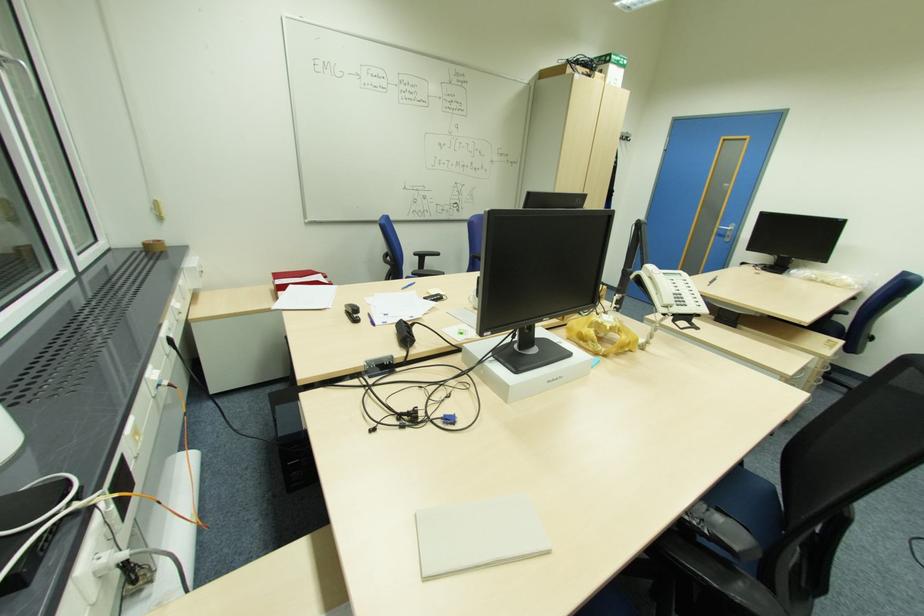
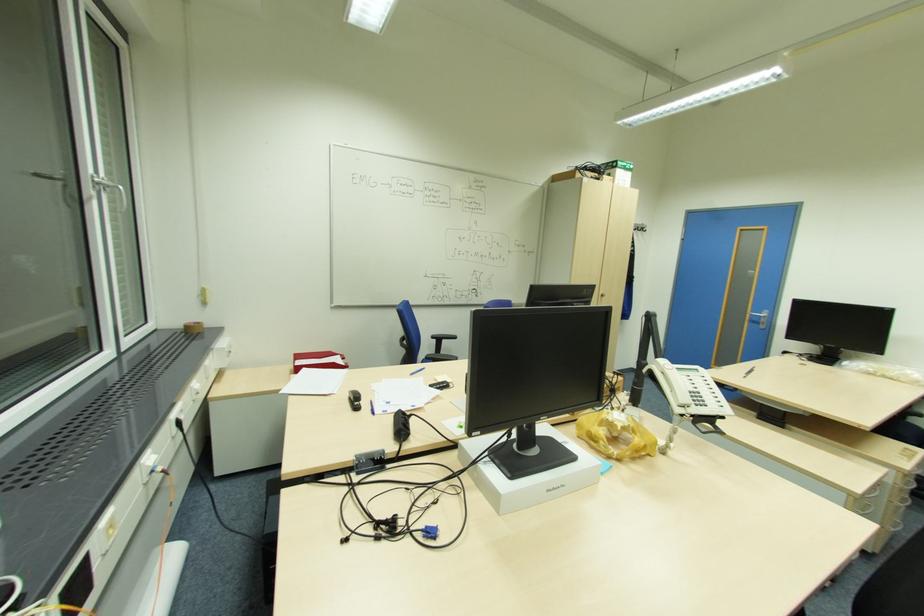
Question: Which direction would the cameraman need to move to produce the second image? Reply with the corresponding letter.

Choices:
 (A) Left
 (B) Right
 (C) Forward
 (D) Backward

Answer: (B)